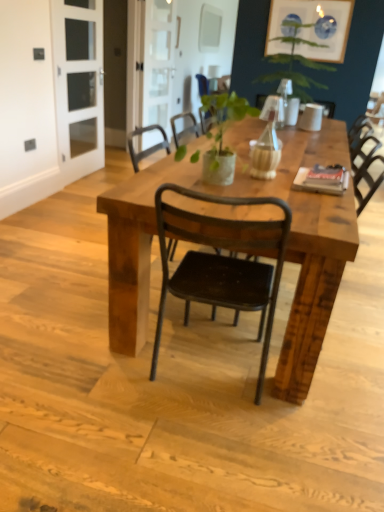
In order to click on free spot to the right of green matte plant at center in this screenshot , I will do `click(280, 194)`.